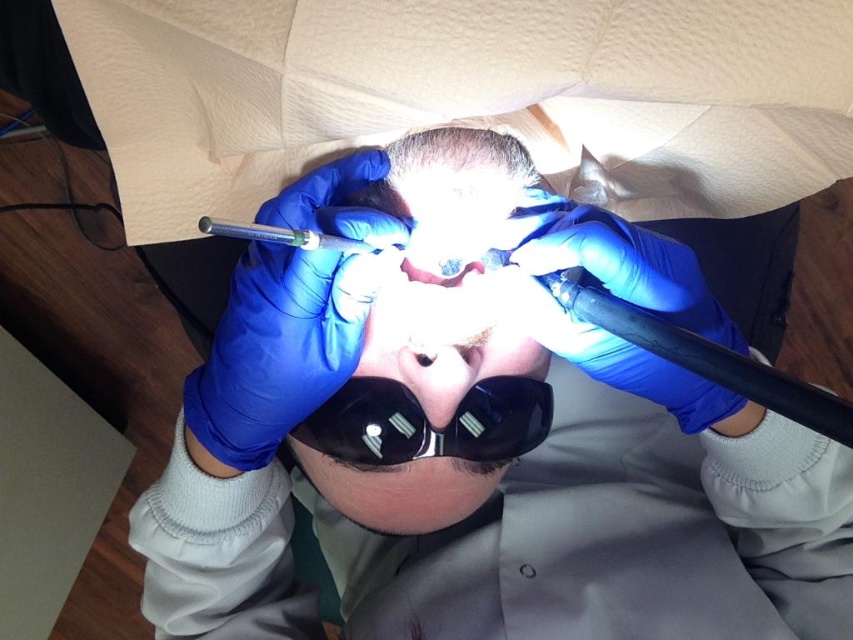
From the picture: Between matte black nose at center and pink rubber mouth at center, which one appears on the right side from the viewer's perspective?

Positioned to the right is pink rubber mouth at center.

Consider the image. Is matte black nose at center positioned in front of pink rubber mouth at center?

That is False.

Between point (440, 358) and point (433, 273), which one is positioned behind?

The point (440, 358) is more distant.

Identify the location of matte black nose at center. The height and width of the screenshot is (640, 853). (438, 378).

Between blue rubber gloves at center and black matte goggles at center, which one has less height?

black matte goggles at center

Is blue rubber gloves at center above black matte goggles at center?

Actually, blue rubber gloves at center is below black matte goggles at center.

The image size is (853, 640). What do you see at coordinates (490, 460) in the screenshot?
I see `blue rubber gloves at center` at bounding box center [490, 460].

Identify the location of blue rubber gloves at center. tap(490, 460).

Can you confirm if pink rubber mouth at center is positioned above translucent plastic eye at center?

Indeed, pink rubber mouth at center is positioned over translucent plastic eye at center.

Between pink rubber mouth at center and translucent plastic eye at center, which one appears on the right side from the viewer's perspective?

From the viewer's perspective, translucent plastic eye at center appears more on the right side.

Who is more forward, (474,262) or (453,346)?

Point (474,262)

Locate an element on the screen. pink rubber mouth at center is located at coordinates (440, 273).